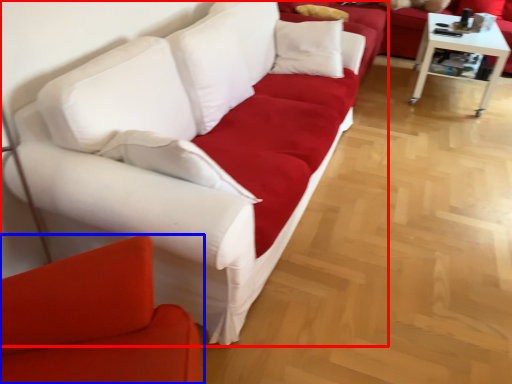
Question: Which object is closer to the camera taking this photo, studio couch (highlighted by a red box) or studio couch (highlighted by a blue box)?

Choices:
 (A) studio couch
 (B) studio couch

Answer: (B)